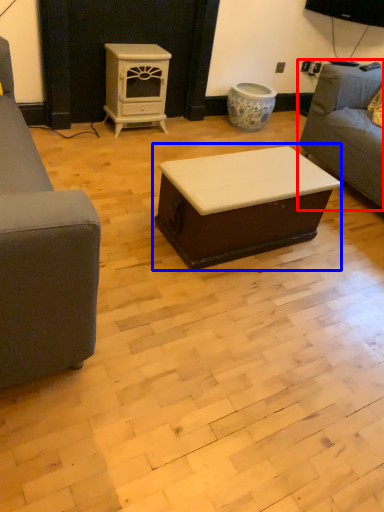
Question: Which object is closer to the camera taking this photo, studio couch (highlighted by a red box) or table (highlighted by a blue box)?

Choices:
 (A) studio couch
 (B) table

Answer: (B)